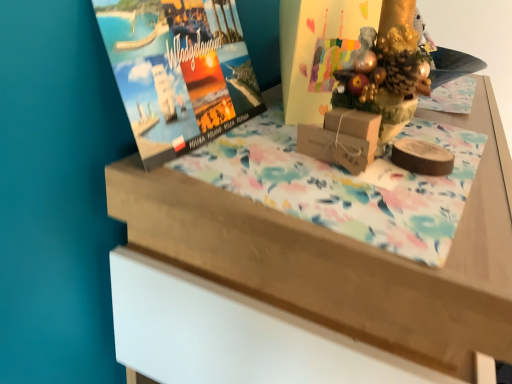
Question: Is the depth of matte cardboard book cover at center less than that of brown cardboard box at center?

Choices:
 (A) no
 (B) yes

Answer: (A)

Question: From the image's perspective, does matte cardboard book cover at center appear lower than brown cardboard box at center?

Choices:
 (A) no
 (B) yes

Answer: (A)

Question: Does matte cardboard book cover at center have a greater height compared to brown cardboard box at center?

Choices:
 (A) no
 (B) yes

Answer: (B)

Question: Is matte cardboard book cover at center looking in the opposite direction of brown cardboard box at center?

Choices:
 (A) no
 (B) yes

Answer: (A)

Question: Is matte cardboard book cover at center surrounding brown cardboard box at center?

Choices:
 (A) yes
 (B) no

Answer: (B)

Question: Can you confirm if matte cardboard book cover at center is positioned to the left of brown cardboard box at center?

Choices:
 (A) yes
 (B) no

Answer: (A)

Question: Does matte paper magazine at upper left have a smaller size compared to wooden table at upper center?

Choices:
 (A) yes
 (B) no

Answer: (A)

Question: Can you confirm if matte paper magazine at upper left is bigger than wooden table at upper center?

Choices:
 (A) yes
 (B) no

Answer: (B)

Question: Considering the relative sizes of matte paper magazine at upper left and wooden table at upper center in the image provided, is matte paper magazine at upper left shorter than wooden table at upper center?

Choices:
 (A) no
 (B) yes

Answer: (B)

Question: Are matte paper magazine at upper left and wooden table at upper center far apart?

Choices:
 (A) yes
 (B) no

Answer: (B)

Question: Can you confirm if matte paper magazine at upper left is positioned to the left of wooden table at upper center?

Choices:
 (A) yes
 (B) no

Answer: (A)

Question: Is matte paper magazine at upper left touching wooden table at upper center?

Choices:
 (A) no
 (B) yes

Answer: (A)

Question: Considering the relative sizes of brown cardboard box at center and matte paper magazine at upper left in the image provided, is brown cardboard box at center thinner than matte paper magazine at upper left?

Choices:
 (A) yes
 (B) no

Answer: (B)